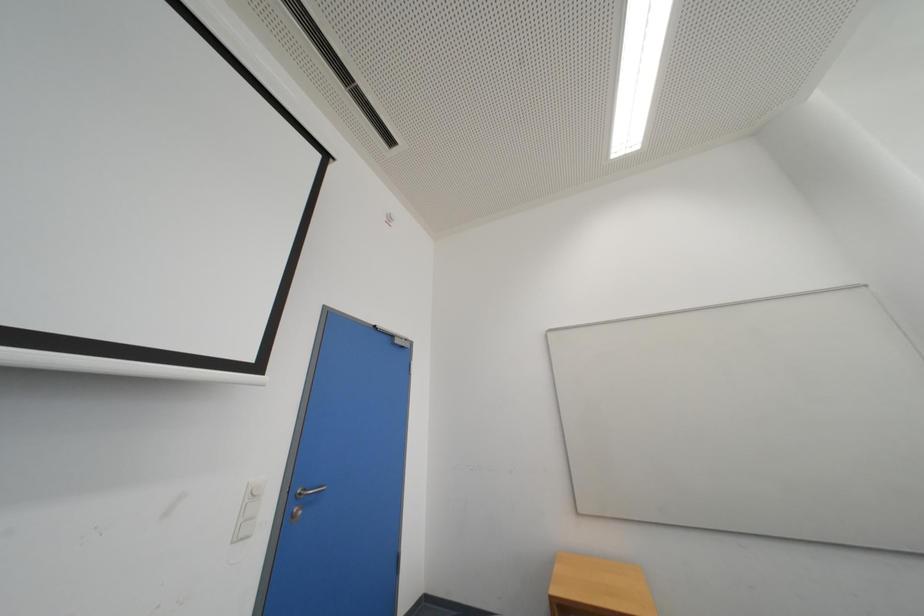
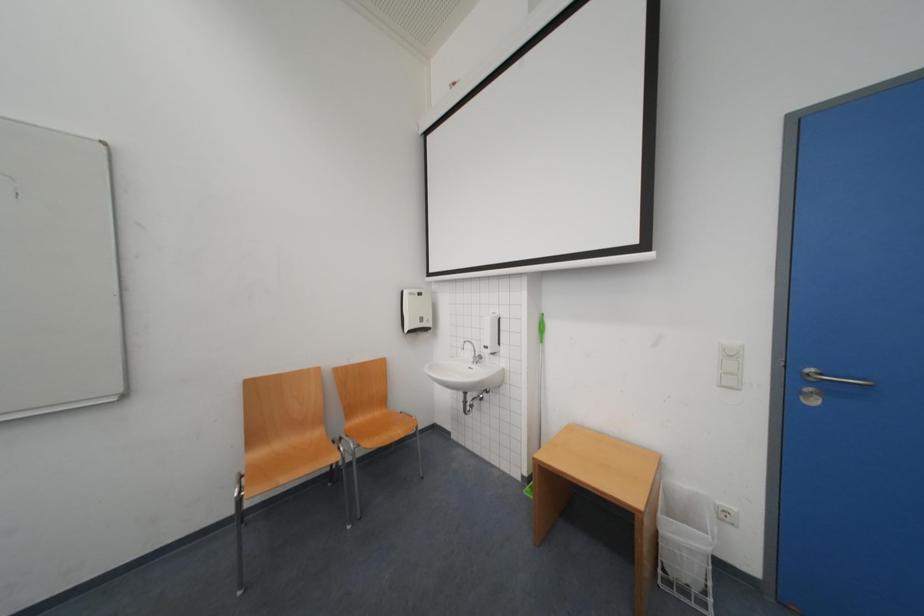
Question: The camera is either moving clockwise (left) or counter-clockwise (right) around the object. The first image is from the beginning of the video and the second image is from the end. Is the camera moving left or right when shooting the video?

Choices:
 (A) Left
 (B) Right

Answer: (B)